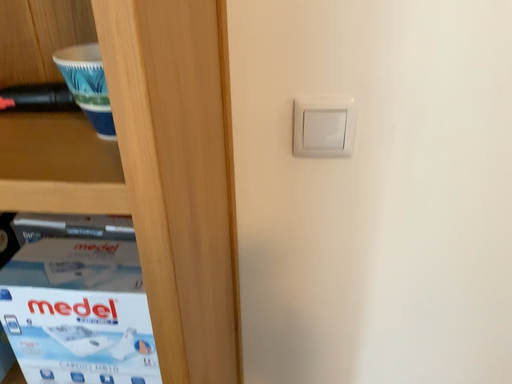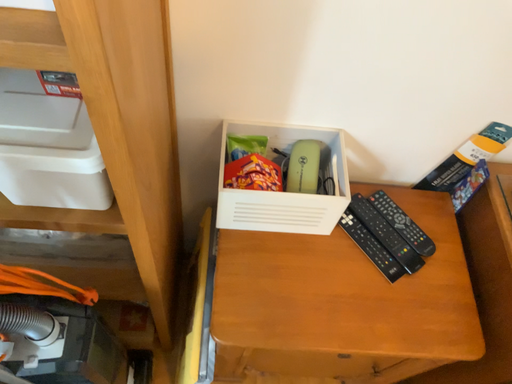
Question: How did the camera likely rotate when shooting the video?

Choices:
 (A) rotated upward
 (B) rotated downward

Answer: (B)